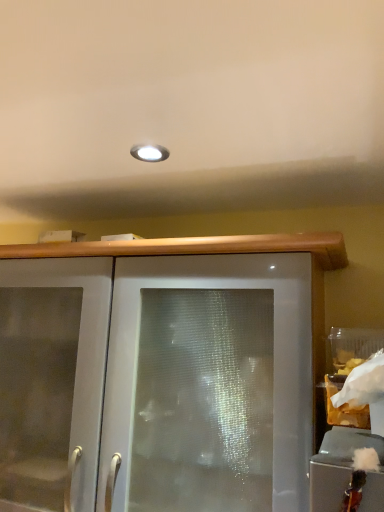
In order to face frosted glass cabinet at lower right, placed as the 2th cabinetry when sorted from left to right, should I rotate leftwards or rightwards?

Rotate your view right by about 20.325°.

Describe the element at coordinates (329, 481) in the screenshot. I see `frosted glass cabinet at lower right, which is the first cabinetry in right-to-left order` at that location.

In order to face white paper bag at right, should I rotate leftwards or rightwards?

Rotate right and turn 23.943 degrees.

What do you see at coordinates (356, 393) in the screenshot?
I see `white paper bag at right` at bounding box center [356, 393].

Locate an element on the screen. The width and height of the screenshot is (384, 512). satin white cabinet at center, which appears as the 1th cabinetry when ordered from the bottom is located at coordinates (162, 372).

Is frosted glass cabinet at lower right, placed as the 2th cabinetry when sorted from left to right, far from white paper bag at right?

No, frosted glass cabinet at lower right, placed as the 2th cabinetry when sorted from left to right, is not far from white paper bag at right.

Between frosted glass cabinet at lower right, arranged as the 1th cabinetry when viewed from the top, and white paper bag at right, which one has less height?

frosted glass cabinet at lower right, arranged as the 1th cabinetry when viewed from the top, is shorter.

Is frosted glass cabinet at lower right, which is the second cabinetry in back-to-front order, outside of white paper bag at right?

Yes, frosted glass cabinet at lower right, which is the second cabinetry in back-to-front order, is outside of white paper bag at right.

From a real-world perspective, is satin white cabinet at center, which appears as the 1th cabinetry when ordered from the bottom, located beneath white paper bag at right?

Yes, from a real-world perspective, satin white cabinet at center, which appears as the 1th cabinetry when ordered from the bottom, is beneath white paper bag at right.

Is satin white cabinet at center, placed as the second cabinetry when sorted from front to back, turned away from white paper bag at right?

No, satin white cabinet at center, placed as the second cabinetry when sorted from front to back, is not facing the opposite direction of white paper bag at right.

Measure the distance between satin white cabinet at center, arranged as the first cabinetry when viewed from the left, and white paper bag at right.

A distance of 18.05 inches exists between satin white cabinet at center, arranged as the first cabinetry when viewed from the left, and white paper bag at right.

From the picture: Is the depth of satin white cabinet at center, placed as the second cabinetry when sorted from front to back, less than that of frosted glass cabinet at lower right, the second cabinetry from the bottom?

No, it is behind frosted glass cabinet at lower right, the second cabinetry from the bottom.

From the image's perspective, is satin white cabinet at center, positioned as the 2th cabinetry in top-to-bottom order, located above or below frosted glass cabinet at lower right, arranged as the 1th cabinetry when viewed from the top?

satin white cabinet at center, positioned as the 2th cabinetry in top-to-bottom order, is below frosted glass cabinet at lower right, arranged as the 1th cabinetry when viewed from the top.

Can you confirm if satin white cabinet at center, positioned as the 2th cabinetry in top-to-bottom order, is wider than frosted glass cabinet at lower right, which is the second cabinetry in back-to-front order?

Yes, satin white cabinet at center, positioned as the 2th cabinetry in top-to-bottom order, is wider than frosted glass cabinet at lower right, which is the second cabinetry in back-to-front order.

Does satin white cabinet at center, positioned as the 2th cabinetry in top-to-bottom order, have a greater height compared to frosted glass cabinet at lower right, arranged as the 1th cabinetry when viewed from the top?

Indeed, satin white cabinet at center, positioned as the 2th cabinetry in top-to-bottom order, has a greater height compared to frosted glass cabinet at lower right, arranged as the 1th cabinetry when viewed from the top.

You are a GUI agent. You are given a task and a screenshot of the screen. Output one action in this format:
    pyautogui.click(x=<x>, y=<y>)
    Task: Click on the cabinetry that is the 1st object to the left of the white paper bag at right, starting at the anchor
    
    Given the screenshot: What is the action you would take?
    pyautogui.click(x=329, y=481)

In the scene shown: Which object is further away from the camera, white paper bag at right or frosted glass cabinet at lower right, which is the second cabinetry in back-to-front order?

white paper bag at right is more distant.

How far apart are white paper bag at right and frosted glass cabinet at lower right, placed as the 2th cabinetry when sorted from left to right?

white paper bag at right and frosted glass cabinet at lower right, placed as the 2th cabinetry when sorted from left to right, are 9.98 inches apart from each other.

Would you say white paper bag at right is a long distance from frosted glass cabinet at lower right, acting as the first cabinetry starting from the front?

Actually, white paper bag at right and frosted glass cabinet at lower right, acting as the first cabinetry starting from the front, are a little close together.

Who is taller, frosted glass cabinet at lower right, placed as the 2th cabinetry when sorted from left to right, or satin white cabinet at center, positioned as the 2th cabinetry in top-to-bottom order?

With more height is satin white cabinet at center, positioned as the 2th cabinetry in top-to-bottom order.

Which of these two, frosted glass cabinet at lower right, which is the first cabinetry in right-to-left order, or satin white cabinet at center, placed as the second cabinetry when sorted from front to back, is wider?

With larger width is satin white cabinet at center, placed as the second cabinetry when sorted from front to back.

Measure the distance from frosted glass cabinet at lower right, placed as the 2th cabinetry when sorted from left to right, to satin white cabinet at center, positioned as the first cabinetry in back-to-front order.

25.29 inches.

From a real-world perspective, is frosted glass cabinet at lower right, arranged as the 1th cabinetry when viewed from the top, physically located above or below satin white cabinet at center, positioned as the 2th cabinetry in top-to-bottom order?

From a real-world perspective, frosted glass cabinet at lower right, arranged as the 1th cabinetry when viewed from the top, is physically above satin white cabinet at center, positioned as the 2th cabinetry in top-to-bottom order.

How far apart are white paper bag at right and satin white cabinet at center, arranged as the second cabinetry when viewed from the right?

white paper bag at right and satin white cabinet at center, arranged as the second cabinetry when viewed from the right, are 45.85 centimeters apart from each other.

Is point (334, 396) closer to viewer compared to point (163, 415)?

Yes, it is.

Who is bigger, white paper bag at right or satin white cabinet at center, positioned as the first cabinetry in back-to-front order?

With larger size is satin white cabinet at center, positioned as the first cabinetry in back-to-front order.

From the image's perspective, which object appears higher, white paper bag at right or satin white cabinet at center, arranged as the second cabinetry when viewed from the right?

white paper bag at right appears higher in the image.

You are a GUI agent. You are given a task and a screenshot of the screen. Output one action in this format:
    pyautogui.click(x=<x>, y=<y>)
    Task: Click on the cabinetry that is in front of the white paper bag at right
    
    Given the screenshot: What is the action you would take?
    pyautogui.click(x=329, y=481)

You are a GUI agent. You are given a task and a screenshot of the screen. Output one action in this format:
    pyautogui.click(x=<x>, y=<y>)
    Task: Click on the food above the satin white cabinet at center, arranged as the first cabinetry when viewed from the left (from a real-world perspective)
    The height and width of the screenshot is (512, 384).
    Given the screenshot: What is the action you would take?
    pyautogui.click(x=356, y=393)

Based on the photo, when comparing their distances from satin white cabinet at center, arranged as the second cabinetry when viewed from the right, does frosted glass cabinet at lower right, arranged as the 1th cabinetry when viewed from the top, or white paper bag at right seem closer?

The object closer to satin white cabinet at center, arranged as the second cabinetry when viewed from the right, is white paper bag at right.

From the image, which object appears to be nearer to frosted glass cabinet at lower right, the second cabinetry from the bottom, satin white cabinet at center, positioned as the 2th cabinetry in top-to-bottom order, or white paper bag at right?

white paper bag at right.

From the image, which object appears to be farther from white paper bag at right, satin white cabinet at center, positioned as the first cabinetry in back-to-front order, or frosted glass cabinet at lower right, placed as the 2th cabinetry when sorted from left to right?

satin white cabinet at center, positioned as the first cabinetry in back-to-front order, is positioned further to the anchor white paper bag at right.

Looking at the image, which one is located further to satin white cabinet at center, arranged as the first cabinetry when viewed from the left, white paper bag at right or frosted glass cabinet at lower right, the second cabinetry from the bottom?

Among the two, frosted glass cabinet at lower right, the second cabinetry from the bottom, is located further to satin white cabinet at center, arranged as the first cabinetry when viewed from the left.

Which object lies further to the anchor point frosted glass cabinet at lower right, arranged as the 1th cabinetry when viewed from the top, white paper bag at right or satin white cabinet at center, which appears as the 1th cabinetry when ordered from the bottom?

satin white cabinet at center, which appears as the 1th cabinetry when ordered from the bottom, lies further to frosted glass cabinet at lower right, arranged as the 1th cabinetry when viewed from the top, than the other object.

Considering their positions, is frosted glass cabinet at lower right, placed as the 2th cabinetry when sorted from left to right, positioned further to white paper bag at right than satin white cabinet at center, which appears as the 1th cabinetry when ordered from the bottom?

Among the two, satin white cabinet at center, which appears as the 1th cabinetry when ordered from the bottom, is located further to white paper bag at right.

Locate an element on the screen. The width and height of the screenshot is (384, 512). cabinetry situated between satin white cabinet at center, placed as the second cabinetry when sorted from front to back, and white paper bag at right from left to right is located at coordinates (329, 481).